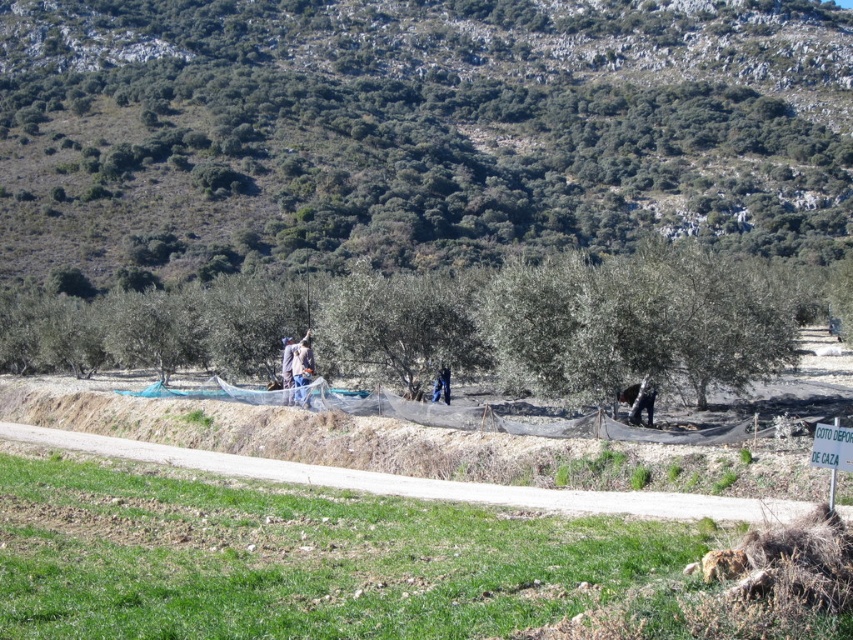
You are a drone operator trying to locate a worker in an olive grove. The worker is wearing blue jeans at center. According to the coordinates provided, where exactly is the worker located in the image?

The worker wearing blue jeans at center is located at coordinates point [299,369] in the image.